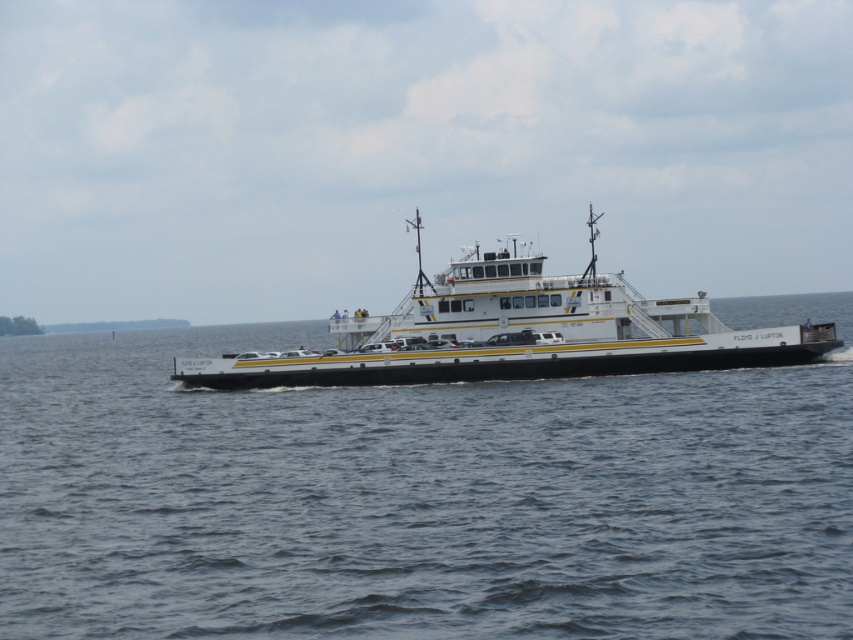
You are a passenger on the ferry named Floyd J. Lupton and you want to take a photo of the black water at center. Where should you stand on the ferry to capture it in your camera frame?

To capture the black water at center at position point (422, 497), you should position yourself centrally on the ferry deck facing towards the direction of travel. This central positioning ensures the black water at center remains centered in your viewfinder.